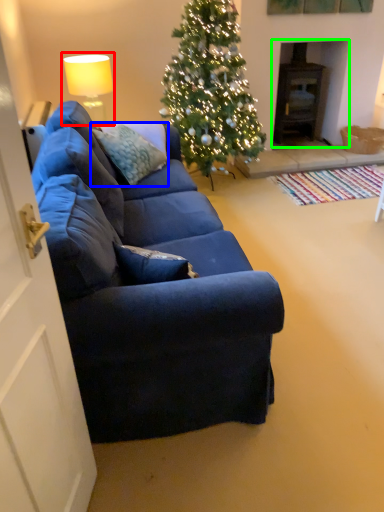
Question: Which is nearer to the lamp (highlighted by a red box)? pillow (highlighted by a blue box) or fireplace (highlighted by a green box).

Choices:
 (A) pillow
 (B) fireplace

Answer: (A)